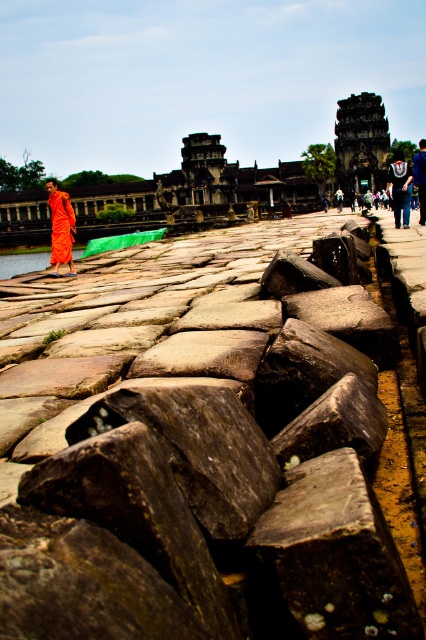
Question: Which of the following is the farthest from the observer?

Choices:
 (A) (422, 214)
 (B) (143, 531)
 (C) (400, 177)

Answer: (C)

Question: Does brown rough stone at left appear on the right side of orange cloth monk at center?

Choices:
 (A) no
 (B) yes

Answer: (A)

Question: Does brown rough stone at left lie behind orange cloth monk at left?

Choices:
 (A) yes
 (B) no

Answer: (B)

Question: Which point appears farthest from the camera in this image?

Choices:
 (A) (425, 141)
 (B) (411, 173)

Answer: (B)

Question: Can you confirm if brown rough stone at left is positioned below orange cloth monk at center?

Choices:
 (A) yes
 (B) no

Answer: (A)

Question: Which point appears closest to the camera in this image?

Choices:
 (A) (388, 180)
 (B) (362, 392)
 (C) (416, 179)

Answer: (B)